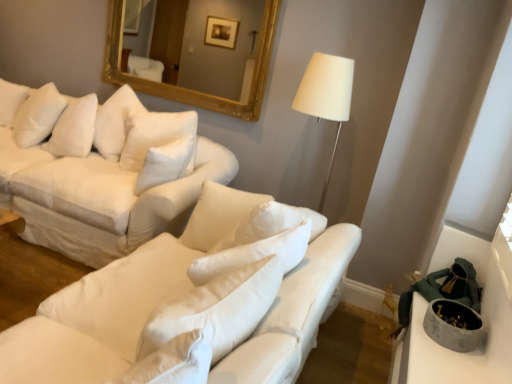
Question: In terms of width, does white fabric couch at center, which ranks as the first studio couch in front-to-back order, look wider or thinner when compared to gold-framed mirror at upper center?

Choices:
 (A) wide
 (B) thin

Answer: (A)

Question: Does point (91, 279) appear closer or farther from the camera than point (257, 94)?

Choices:
 (A) farther
 (B) closer

Answer: (B)

Question: Estimate the real-world distances between objects in this image. Which object is farther from the gold-framed mirror at upper center?

Choices:
 (A) white fabric couch at center, marked as the 2th studio couch in a back-to-front arrangement
 (B) concrete bowl at lower right
 (C) white fabric couch at upper left, acting as the 1th studio couch starting from the back
 (D) white soft pillow at upper left

Answer: (B)

Question: Estimate the real-world distances between objects in this image. Which object is farther from the gold-framed mirror at upper center?

Choices:
 (A) white fabric couch at upper left, acting as the 1th studio couch starting from the back
 (B) white fabric couch at center, which ranks as the first studio couch in front-to-back order
 (C) white soft pillow at upper left
 (D) concrete bowl at lower right

Answer: (D)